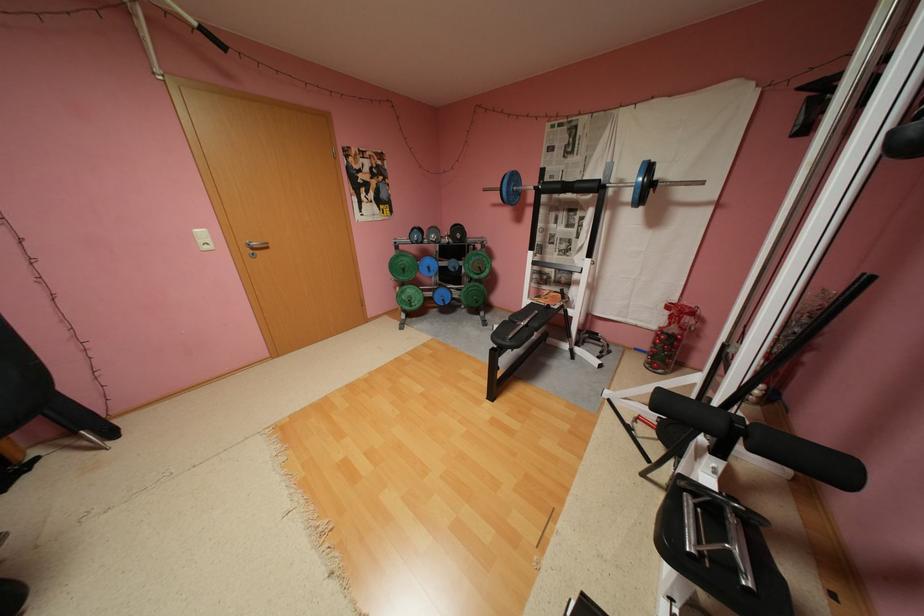
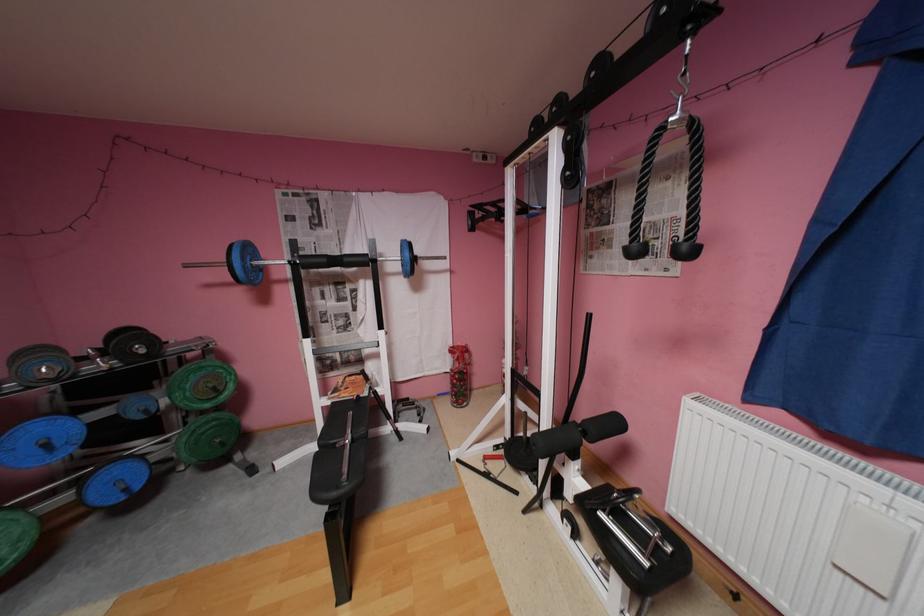
In the second image, find the point that corresponds to pixel 438 268 in the first image.

(55, 445)